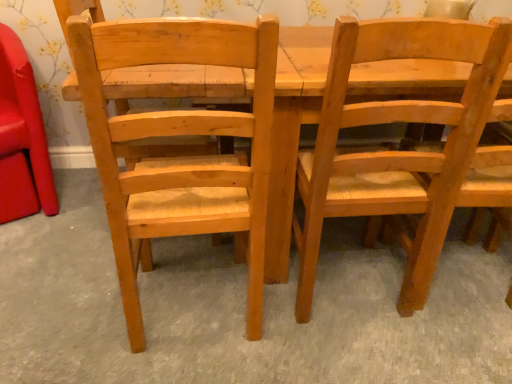
Describe the element at coordinates (22, 137) in the screenshot. I see `matte wood chair at left, which is the first chair from left to right` at that location.

The height and width of the screenshot is (384, 512). Describe the element at coordinates (179, 135) in the screenshot. I see `natural wood chair at left, marked as the second chair in a right-to-left arrangement` at that location.

In order to face natural wood chair at left, which appears as the second chair when viewed from the left, should I rotate leftwards or rightwards?

Turn left approximately 9.431 degrees to face it.

Identify the location of matte wood chair at left, which appears as the 3th chair when viewed from the right. This screenshot has height=384, width=512. (22, 137).

From the image's perspective, is matte wood chair at left, which appears as the 3th chair when viewed from the right, beneath light brown wood chair at center, the 3th chair in the left-to-right sequence?

Actually, matte wood chair at left, which appears as the 3th chair when viewed from the right, appears above light brown wood chair at center, the 3th chair in the left-to-right sequence, in the image.

Does matte wood chair at left, which is the first chair from left to right, have a larger size compared to light brown wood chair at center, the 3th chair in the left-to-right sequence?

Incorrect, matte wood chair at left, which is the first chair from left to right, is not larger than light brown wood chair at center, the 3th chair in the left-to-right sequence.

Is matte wood chair at left, which is the first chair from left to right, wider or thinner than light brown wood chair at center, acting as the first chair starting from the right?

Clearly, matte wood chair at left, which is the first chair from left to right, has more width compared to light brown wood chair at center, acting as the first chair starting from the right.

Could you measure the distance between matte wood chair at left, which is the first chair from left to right, and light brown wood chair at center, the 3th chair in the left-to-right sequence?

matte wood chair at left, which is the first chair from left to right, is 1.27 meters away from light brown wood chair at center, the 3th chair in the left-to-right sequence.

Could you measure the distance between natural wood chair at left, which appears as the second chair when viewed from the left, and light brown wood chair at center, acting as the first chair starting from the right?

A distance of 34.18 centimeters exists between natural wood chair at left, which appears as the second chair when viewed from the left, and light brown wood chair at center, acting as the first chair starting from the right.

Does point (131, 228) come farther from viewer compared to point (450, 55)?

Yes, it is behind point (450, 55).

At what (x,y) coordinates should I click in order to perform the action: click on the 1st chair located beneath the natural wood chair at left, which appears as the second chair when viewed from the left (from a real-world perspective). Please return your answer as a coordinate pair (x, y). The height and width of the screenshot is (384, 512). Looking at the image, I should click on (398, 151).

Is natural wood chair at left, marked as the second chair in a right-to-left arrangement, completely or partially outside of light brown wood chair at center, acting as the first chair starting from the right?

Yes.

Is point (393, 105) positioned after point (38, 175)?

That is False.

Considering the positions of objects light brown wood chair at center, the 3th chair in the left-to-right sequence, and matte wood chair at left, which appears as the 3th chair when viewed from the right, in the image provided, who is more to the right, light brown wood chair at center, the 3th chair in the left-to-right sequence, or matte wood chair at left, which appears as the 3th chair when viewed from the right,?

From the viewer's perspective, light brown wood chair at center, the 3th chair in the left-to-right sequence, appears more on the right side.

Is light brown wood chair at center, the 3th chair in the left-to-right sequence, far away from matte wood chair at left, which is the first chair from left to right?

light brown wood chair at center, the 3th chair in the left-to-right sequence, is positioned a significant distance from matte wood chair at left, which is the first chair from left to right.

Consider the image. Does light brown wood chair at center, acting as the first chair starting from the right, have a lesser height compared to matte wood chair at left, which appears as the 3th chair when viewed from the right?

No, light brown wood chair at center, acting as the first chair starting from the right, is not shorter than matte wood chair at left, which appears as the 3th chair when viewed from the right.

Between matte wood chair at left, which is the first chair from left to right, and natural wood chair at left, marked as the second chair in a right-to-left arrangement, which one appears on the left side from the viewer's perspective?

matte wood chair at left, which is the first chair from left to right.

Which is correct: matte wood chair at left, which appears as the 3th chair when viewed from the right, is inside natural wood chair at left, marked as the second chair in a right-to-left arrangement, or outside of it?

matte wood chair at left, which appears as the 3th chair when viewed from the right, exists outside the volume of natural wood chair at left, marked as the second chair in a right-to-left arrangement.

Is matte wood chair at left, which appears as the 3th chair when viewed from the right, positioned with its back to natural wood chair at left, which appears as the second chair when viewed from the left?

No.

Which object is thinner, light brown wood chair at center, acting as the first chair starting from the right, or natural wood chair at left, which appears as the second chair when viewed from the left?

Thinner between the two is natural wood chair at left, which appears as the second chair when viewed from the left.

From the image's perspective, would you say light brown wood chair at center, the 3th chair in the left-to-right sequence, is shown under natural wood chair at left, which appears as the second chair when viewed from the left?

Actually, light brown wood chair at center, the 3th chair in the left-to-right sequence, appears above natural wood chair at left, which appears as the second chair when viewed from the left, in the image.

In terms of size, does light brown wood chair at center, the 3th chair in the left-to-right sequence, appear bigger or smaller than natural wood chair at left, which appears as the second chair when viewed from the left?

light brown wood chair at center, the 3th chair in the left-to-right sequence, is smaller than natural wood chair at left, which appears as the second chair when viewed from the left.

Does point (267, 61) lie in front of point (29, 92)?

Yes, point (267, 61) is closer to viewer.

Does natural wood chair at left, which appears as the second chair when viewed from the left, have a greater width compared to matte wood chair at left, which appears as the 3th chair when viewed from the right?

Incorrect, the width of natural wood chair at left, which appears as the second chair when viewed from the left, does not surpass that of matte wood chair at left, which appears as the 3th chair when viewed from the right.

From a real-world perspective, is natural wood chair at left, which appears as the second chair when viewed from the left, on matte wood chair at left, which appears as the 3th chair when viewed from the right?

Yes, from a real-world perspective, natural wood chair at left, which appears as the second chair when viewed from the left, is above matte wood chair at left, which appears as the 3th chair when viewed from the right.

Which chair is the 1st one when counting from the front of the matte wood chair at left, which is the first chair from left to right? Please provide its 2D coordinates.

[(398, 151)]

The image size is (512, 384). Find the location of `chair that is on the right side of natural wood chair at left, which appears as the second chair when viewed from the left`. chair that is on the right side of natural wood chair at left, which appears as the second chair when viewed from the left is located at coordinates (398, 151).

Based on their spatial positions, is natural wood chair at left, which appears as the second chair when viewed from the left, or matte wood chair at left, which appears as the 3th chair when viewed from the right, further from light brown wood chair at center, the 3th chair in the left-to-right sequence?

The object further to light brown wood chair at center, the 3th chair in the left-to-right sequence, is matte wood chair at left, which appears as the 3th chair when viewed from the right.

Which object lies nearer to the anchor point natural wood chair at left, marked as the second chair in a right-to-left arrangement, light brown wood chair at center, acting as the first chair starting from the right, or matte wood chair at left, which is the first chair from left to right?

Among the two, light brown wood chair at center, acting as the first chair starting from the right, is located nearer to natural wood chair at left, marked as the second chair in a right-to-left arrangement.

From the image, which object appears to be farther from matte wood chair at left, which is the first chair from left to right, light brown wood chair at center, the 3th chair in the left-to-right sequence, or natural wood chair at left, which appears as the second chair when viewed from the left?

The object further to matte wood chair at left, which is the first chair from left to right, is light brown wood chair at center, the 3th chair in the left-to-right sequence.

From the image, which object appears to be nearer to natural wood chair at left, marked as the second chair in a right-to-left arrangement, matte wood chair at left, which is the first chair from left to right, or light brown wood chair at center, the 3th chair in the left-to-right sequence?

light brown wood chair at center, the 3th chair in the left-to-right sequence, is positioned closer to the anchor natural wood chair at left, marked as the second chair in a right-to-left arrangement.

Looking at the image, which one is located closer to light brown wood chair at center, acting as the first chair starting from the right, matte wood chair at left, which appears as the 3th chair when viewed from the right, or natural wood chair at left, which appears as the second chair when viewed from the left?

natural wood chair at left, which appears as the second chair when viewed from the left, is closer to light brown wood chair at center, acting as the first chair starting from the right.

From the image, which object appears to be nearer to matte wood chair at left, which appears as the 3th chair when viewed from the right, natural wood chair at left, marked as the second chair in a right-to-left arrangement, or light brown wood chair at center, the 3th chair in the left-to-right sequence?

natural wood chair at left, marked as the second chair in a right-to-left arrangement.

Where is `chair between matte wood chair at left, which appears as the 3th chair when viewed from the right, and light brown wood chair at center, the 3th chair in the left-to-right sequence`? chair between matte wood chair at left, which appears as the 3th chair when viewed from the right, and light brown wood chair at center, the 3th chair in the left-to-right sequence is located at coordinates (179, 135).